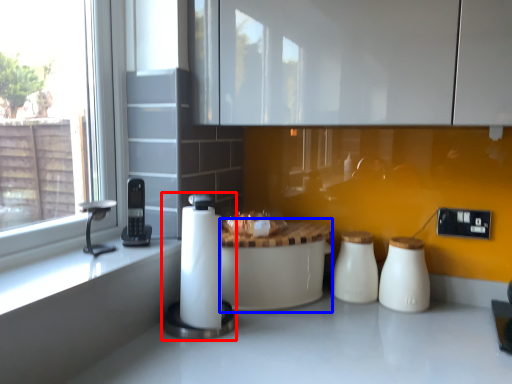
Question: Among these objects, which one is farthest to the camera, appliance (highlighted by a red box) or table (highlighted by a blue box)?

Choices:
 (A) appliance
 (B) table

Answer: (B)